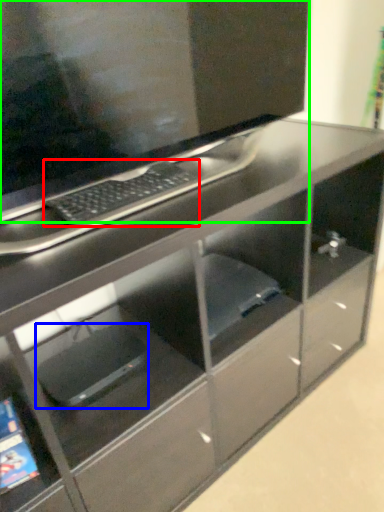
Question: Based on their relative distances, which object is nearer to computer keyboard (highlighted by a red box)? Choose from computer (highlighted by a blue box) and computer monitor (highlighted by a green box).

Choices:
 (A) computer
 (B) computer monitor

Answer: (B)